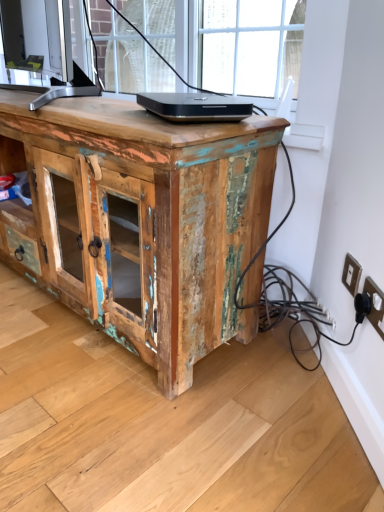
Describe the element at coordinates (375, 305) in the screenshot. The width and height of the screenshot is (384, 512). I see `black plastic electric outlet at lower right, the first electric outlet positioned from the front` at that location.

What is the approximate width of white plastic electric outlet at lower right, the second electric outlet when ordered from front to back?

white plastic electric outlet at lower right, the second electric outlet when ordered from front to back, is 0.54 inches wide.

Find the location of a particular element. black plastic electric outlet at lower right, the 2th electric outlet positioned from the back is located at coordinates (375, 305).

How different are the orientations of white plastic electric outlet at lower right, acting as the first electric outlet starting from the back, and black glossy laptop at center in degrees?

The angle between the facing direction of white plastic electric outlet at lower right, acting as the first electric outlet starting from the back, and the facing direction of black glossy laptop at center is 16.6 degrees.

Considering the relative sizes of white plastic electric outlet at lower right, the second electric outlet when ordered from front to back, and black glossy laptop at center in the image provided, is white plastic electric outlet at lower right, the second electric outlet when ordered from front to back, wider than black glossy laptop at center?

No, white plastic electric outlet at lower right, the second electric outlet when ordered from front to back, is not wider than black glossy laptop at center.

Is white plastic electric outlet at lower right, the second electric outlet when ordered from front to back, to the left of black glossy laptop at center from the viewer's perspective?

No, white plastic electric outlet at lower right, the second electric outlet when ordered from front to back, is not to the left of black glossy laptop at center.

Could you measure the distance between white plastic electric outlet at lower right, acting as the first electric outlet starting from the back, and black glossy laptop at center?

white plastic electric outlet at lower right, acting as the first electric outlet starting from the back, and black glossy laptop at center are 22.02 inches apart from each other.

Is black plastic electric outlet at lower right, the first electric outlet positioned from the front, oriented away from black glossy laptop at center?

black plastic electric outlet at lower right, the first electric outlet positioned from the front, does not have its back to black glossy laptop at center.

Where is `laptop above the black plastic electric outlet at lower right, the 2th electric outlet positioned from the back (from the image's perspective)`? The image size is (384, 512). laptop above the black plastic electric outlet at lower right, the 2th electric outlet positioned from the back (from the image's perspective) is located at coordinates (195, 106).

Considering the sizes of objects black plastic electric outlet at lower right, the 2th electric outlet positioned from the back, and black glossy laptop at center in the image provided, who is shorter, black plastic electric outlet at lower right, the 2th electric outlet positioned from the back, or black glossy laptop at center?

black glossy laptop at center.

Which is behind, black plastic electric outlet at lower right, the 2th electric outlet positioned from the back, or black glossy laptop at center?

black glossy laptop at center is further from the camera.

From a real-world perspective, which object stands above the other?

black glossy laptop at center, from a real-world perspective.

Is black glossy laptop at center in front of or behind weathered wood cabinet at center in the image?

black glossy laptop at center is behind weathered wood cabinet at center.

Locate an element on the screen. desk that is on the left side of black glossy laptop at center is located at coordinates (141, 220).

Consider the image. Considering the relative sizes of black glossy laptop at center and weathered wood cabinet at center in the image provided, is black glossy laptop at center bigger than weathered wood cabinet at center?

No, black glossy laptop at center is not bigger than weathered wood cabinet at center.

Does black glossy laptop at center touch white plastic electric outlet at lower right, the second electric outlet when ordered from front to back?

No.

From the image's perspective, which is above, black glossy laptop at center or white plastic electric outlet at lower right, acting as the first electric outlet starting from the back?

black glossy laptop at center.

Is black glossy laptop at center taller or shorter than white plastic electric outlet at lower right, the second electric outlet when ordered from front to back?

Clearly, black glossy laptop at center is shorter compared to white plastic electric outlet at lower right, the second electric outlet when ordered from front to back.

Is black glossy laptop at center oriented towards white plastic electric outlet at lower right, the second electric outlet when ordered from front to back?

No, black glossy laptop at center is not turned towards white plastic electric outlet at lower right, the second electric outlet when ordered from front to back.

In the image, is white plastic electric outlet at lower right, acting as the first electric outlet starting from the back, on the left side or the right side of black plastic electric outlet at lower right, the 2th electric outlet positioned from the back?

white plastic electric outlet at lower right, acting as the first electric outlet starting from the back, is positioned on black plastic electric outlet at lower right, the 2th electric outlet positioned from the back,'s left side.

Is white plastic electric outlet at lower right, the second electric outlet when ordered from front to back, not near black plastic electric outlet at lower right, the 2th electric outlet positioned from the back?

white plastic electric outlet at lower right, the second electric outlet when ordered from front to back, is near black plastic electric outlet at lower right, the 2th electric outlet positioned from the back, not far away.

Does white plastic electric outlet at lower right, acting as the first electric outlet starting from the back, come in front of black plastic electric outlet at lower right, the first electric outlet positioned from the front?

No, white plastic electric outlet at lower right, acting as the first electric outlet starting from the back, is behind black plastic electric outlet at lower right, the first electric outlet positioned from the front.

Is white plastic electric outlet at lower right, the second electric outlet when ordered from front to back, to the left of weathered wood cabinet at center from the viewer's perspective?

No.

Looking at this image, which is less distant, (x=348, y=272) or (x=225, y=151)?

Point (x=348, y=272) is positioned farther from the camera compared to point (x=225, y=151).

Identify the location of desk in front of the white plastic electric outlet at lower right, acting as the first electric outlet starting from the back. The image size is (384, 512). (141, 220).

From the image's perspective, would you say white plastic electric outlet at lower right, the second electric outlet when ordered from front to back, is shown under weathered wood cabinet at center?

Yes, from the image's perspective, white plastic electric outlet at lower right, the second electric outlet when ordered from front to back, is beneath weathered wood cabinet at center.

Would you say white plastic electric outlet at lower right, the second electric outlet when ordered from front to back, is part of black plastic electric outlet at lower right, the first electric outlet positioned from the front,'s contents?

No, white plastic electric outlet at lower right, the second electric outlet when ordered from front to back, is located outside of black plastic electric outlet at lower right, the first electric outlet positioned from the front.

Which of these two, black plastic electric outlet at lower right, the 2th electric outlet positioned from the back, or white plastic electric outlet at lower right, acting as the first electric outlet starting from the back, stands taller?

black plastic electric outlet at lower right, the 2th electric outlet positioned from the back.

Is black plastic electric outlet at lower right, the 2th electric outlet positioned from the back, in front of or behind white plastic electric outlet at lower right, the second electric outlet when ordered from front to back, in the image?

black plastic electric outlet at lower right, the 2th electric outlet positioned from the back, is in front of white plastic electric outlet at lower right, the second electric outlet when ordered from front to back.

Between point (374, 311) and point (354, 258), which one is positioned behind?

Point (354, 258)

The image size is (384, 512). I want to click on laptop that appears above the white plastic electric outlet at lower right, the second electric outlet when ordered from front to back (from a real-world perspective), so click(x=195, y=106).

This screenshot has height=512, width=384. Identify the location of the 2nd electric outlet below the black glossy laptop at center (from the image's perspective). (375, 305).

Based on their spatial positions, is weathered wood cabinet at center or white plastic electric outlet at lower right, acting as the first electric outlet starting from the back, closer to black plastic electric outlet at lower right, the 2th electric outlet positioned from the back?

white plastic electric outlet at lower right, acting as the first electric outlet starting from the back, lies closer to black plastic electric outlet at lower right, the 2th electric outlet positioned from the back, than the other object.

Estimate the real-world distances between objects in this image. Which object is closer to black plastic electric outlet at lower right, the 2th electric outlet positioned from the back, white plastic electric outlet at lower right, acting as the first electric outlet starting from the back, or black glossy laptop at center?

The object closer to black plastic electric outlet at lower right, the 2th electric outlet positioned from the back, is white plastic electric outlet at lower right, acting as the first electric outlet starting from the back.

Estimate the real-world distances between objects in this image. Which object is further from weathered wood cabinet at center, white plastic electric outlet at lower right, acting as the first electric outlet starting from the back, or black glossy laptop at center?

The object further to weathered wood cabinet at center is white plastic electric outlet at lower right, acting as the first electric outlet starting from the back.

Considering their positions, is weathered wood cabinet at center positioned further to white plastic electric outlet at lower right, the second electric outlet when ordered from front to back, than black plastic electric outlet at lower right, the 2th electric outlet positioned from the back?

Based on the image, weathered wood cabinet at center appears to be further to white plastic electric outlet at lower right, the second electric outlet when ordered from front to back.

From the image, which object appears to be nearer to black glossy laptop at center, white plastic electric outlet at lower right, acting as the first electric outlet starting from the back, or weathered wood cabinet at center?

Among the two, weathered wood cabinet at center is located nearer to black glossy laptop at center.

From the image, which object appears to be nearer to white plastic electric outlet at lower right, the second electric outlet when ordered from front to back, weathered wood cabinet at center or black glossy laptop at center?

The object closer to white plastic electric outlet at lower right, the second electric outlet when ordered from front to back, is black glossy laptop at center.

Estimate the real-world distances between objects in this image. Which object is closer to weathered wood cabinet at center, white plastic electric outlet at lower right, acting as the first electric outlet starting from the back, or black plastic electric outlet at lower right, the 2th electric outlet positioned from the back?

Based on the image, white plastic electric outlet at lower right, acting as the first electric outlet starting from the back, appears to be nearer to weathered wood cabinet at center.

From the image, which object appears to be nearer to weathered wood cabinet at center, black glossy laptop at center or black plastic electric outlet at lower right, the 2th electric outlet positioned from the back?

The object closer to weathered wood cabinet at center is black glossy laptop at center.

I want to click on electric outlet between weathered wood cabinet at center and black plastic electric outlet at lower right, the first electric outlet positioned from the front, so click(351, 274).

I want to click on laptop situated between weathered wood cabinet at center and white plastic electric outlet at lower right, the second electric outlet when ordered from front to back, from left to right, so click(x=195, y=106).

The image size is (384, 512). Find the location of `electric outlet between black glossy laptop at center and black plastic electric outlet at lower right, the first electric outlet positioned from the front, in the up-down direction`. electric outlet between black glossy laptop at center and black plastic electric outlet at lower right, the first electric outlet positioned from the front, in the up-down direction is located at coordinates (351, 274).

Find the location of a particular element. Image resolution: width=384 pixels, height=512 pixels. laptop between weathered wood cabinet at center and black plastic electric outlet at lower right, the 2th electric outlet positioned from the back, in the horizontal direction is located at coordinates (195, 106).